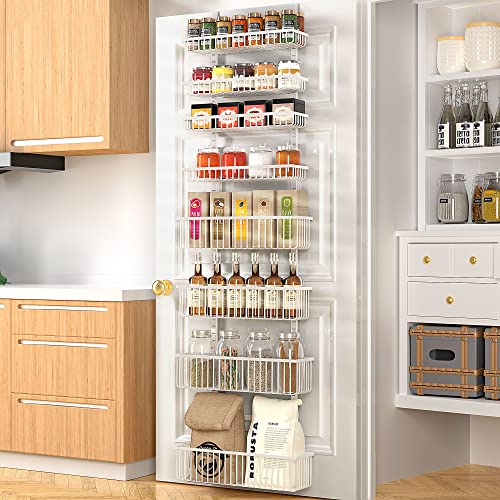
You are a GUI agent. You are given a task and a screenshot of the screen. Output one action in this format:
    pyautogui.click(x=<x>, y=<y>)
    Task: Click on the brown boxes
    The image size is (500, 500).
    Given the screenshot: What is the action you would take?
    pyautogui.click(x=200, y=197), pyautogui.click(x=212, y=195), pyautogui.click(x=238, y=195), pyautogui.click(x=266, y=195), pyautogui.click(x=279, y=195)